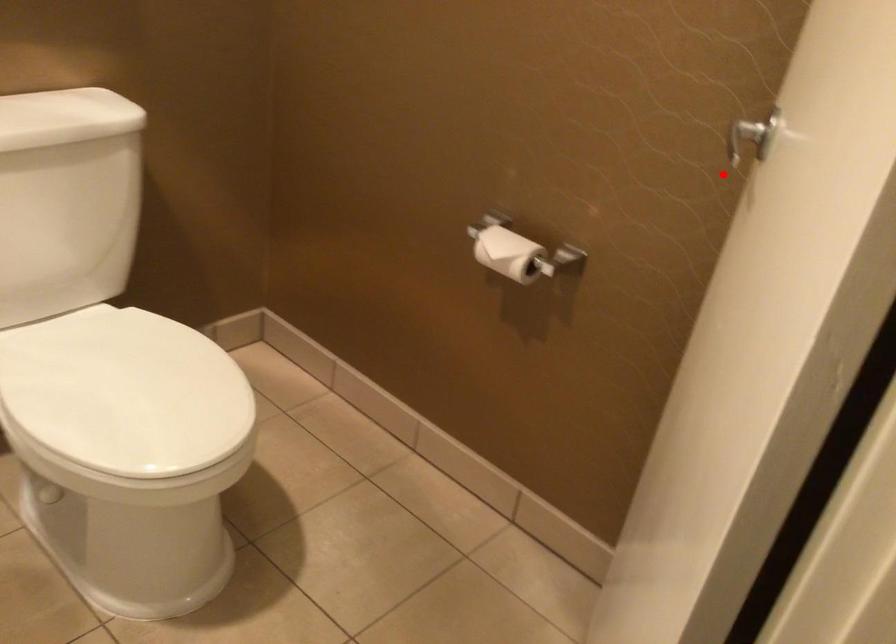
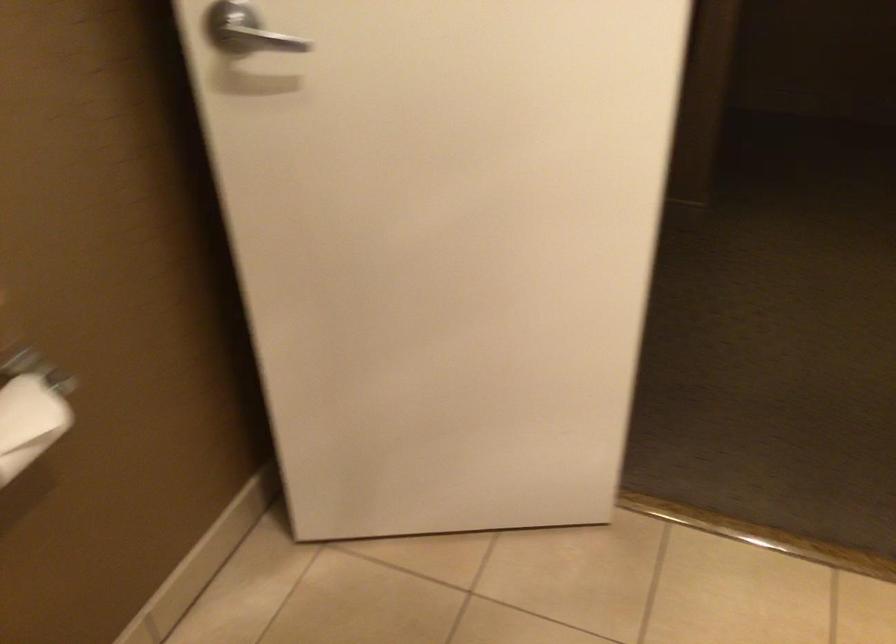
Question: I am providing you with two images of the same scene from different viewpoints. Image1 has a red point marked. In image2, the corresponding 3D location appears at what relative position? Reply with the corresponding letter.

Choices:
 (A) Closer
 (B) Farther

Answer: (A)